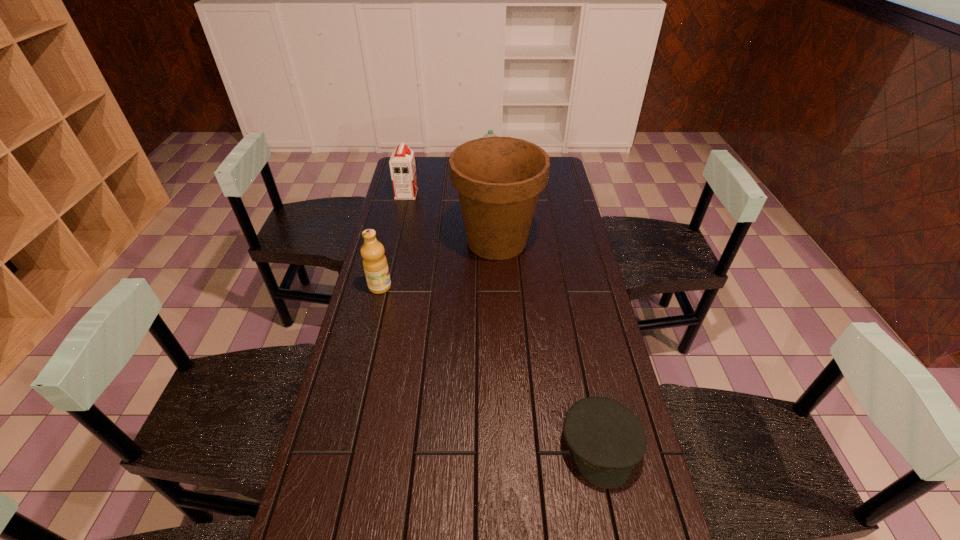
Where is `blank region between the beret and the water bottle`? blank region between the beret and the water bottle is located at coordinates click(545, 314).

You are a GUI agent. You are given a task and a screenshot of the screen. Output one action in this format:
    pyautogui.click(x=<x>, y=<y>)
    Task: Click on the object that ranks as the fourth closest to the nearest object
    This screenshot has width=960, height=540.
    Given the screenshot: What is the action you would take?
    pyautogui.click(x=490, y=133)

Where is `the second closest object to the third nearest object`? Image resolution: width=960 pixels, height=540 pixels. the second closest object to the third nearest object is located at coordinates (402, 162).

Where is `vacant space that satisfies the following two spatial constraints: 1. on the front side of the water bottle; 2. on the label of the second nearest object`? The image size is (960, 540). vacant space that satisfies the following two spatial constraints: 1. on the front side of the water bottle; 2. on the label of the second nearest object is located at coordinates (493, 287).

Where is `free space in the image that satisfies the following two spatial constraints: 1. on the front side of the third farthest object; 2. on the left side of the water bottle`? The image size is (960, 540). free space in the image that satisfies the following two spatial constraints: 1. on the front side of the third farthest object; 2. on the left side of the water bottle is located at coordinates (492, 241).

You are a GUI agent. You are given a task and a screenshot of the screen. Output one action in this format:
    pyautogui.click(x=<x>, y=<y>)
    Task: Click on the free region that satisfies the following two spatial constraints: 1. on the front side of the tallest object; 2. on the right side of the soya milk
    
    Given the screenshot: What is the action you would take?
    pyautogui.click(x=396, y=241)